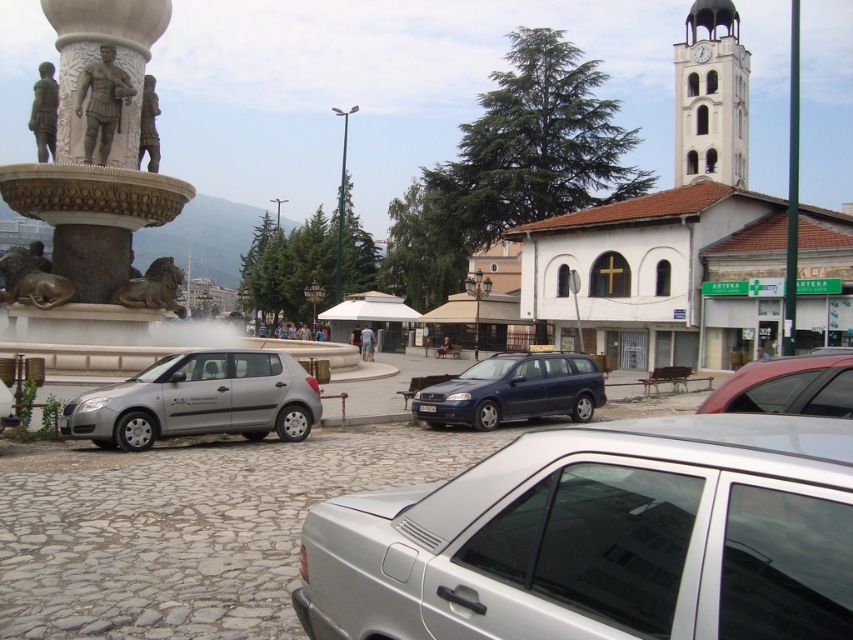
You need to park your car, which is 1.8 meters wide, in the parking area. The satin silver car at lower left is parked next to the bronze statue of lion at left. Can your car fit in the space between them?

The satin silver car at lower left is wider than the bronze statue of lion at left. However, without knowing the exact distance between them, it is impossible to determine if your car will fit. Please check the available space physically.

You are standing in the urban square and want to take a photo of the white matte church at upper center. Which direction should you face to ensure the church is in the frame?

You should face towards the upper center direction to capture the white matte church at upper center in your photo, as it is located at point coordinates of (671, 230).

You are standing in the urban square and want to take a photo of the white matte church at upper center. If your camera has a maximum zoom range of 50 feet, will you be able to capture the church clearly without moving closer?

The white matte church at upper center is 61.05 feet away from the viewer. Since the camera can only zoom up to 50 feet, you won cannot capture the church clearly without moving closer.